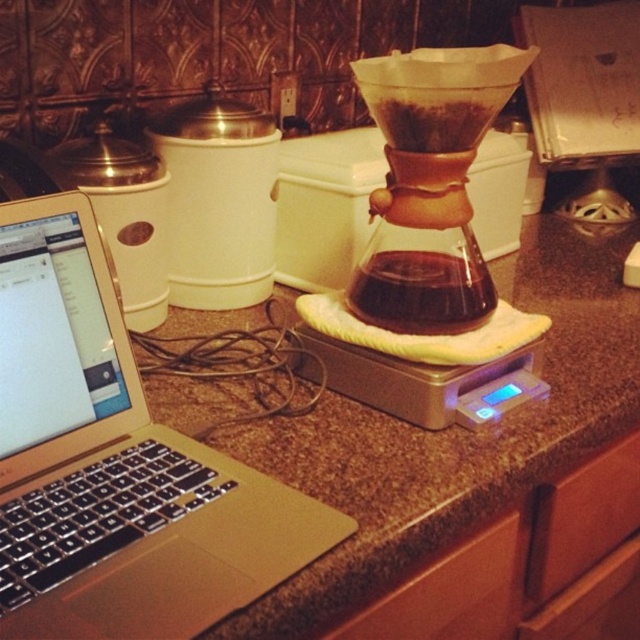
Can you confirm if transparent glass carafe at center is wider than brown wood drawer at lower right?

Correct, the width of transparent glass carafe at center exceeds that of brown wood drawer at lower right.

Is point (396, 172) in front of point (572, 566)?

Yes.

Where is `transparent glass carafe at center`? This screenshot has width=640, height=640. transparent glass carafe at center is located at coordinates (428, 253).

Who is positioned more to the right, brown wood drawer at lower center or brown wood drawer at lower right?

brown wood drawer at lower right

Find the location of a particular element. The image size is (640, 640). brown wood drawer at lower center is located at coordinates (449, 593).

At what (x,y) coordinates should I click in order to perform the action: click on brown wood drawer at lower center. Please return your answer as a coordinate pair (x, y). This screenshot has width=640, height=640. Looking at the image, I should click on (449, 593).

Does gold metallic laptop at left have a larger size compared to transparent glass carafe at center?

No, gold metallic laptop at left is not bigger than transparent glass carafe at center.

Describe the element at coordinates (115, 465) in the screenshot. I see `gold metallic laptop at left` at that location.

Does point (129, 419) come in front of point (460, 296)?

Yes.

Identify the location of gold metallic laptop at left. (115, 465).